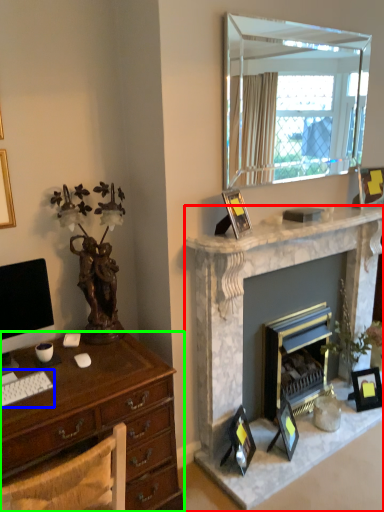
Question: Based on their relative distances, which object is nearer to fireplace (highlighted by a red box)? Choose from computer keyboard (highlighted by a blue box) and desk (highlighted by a green box).

Choices:
 (A) computer keyboard
 (B) desk

Answer: (B)